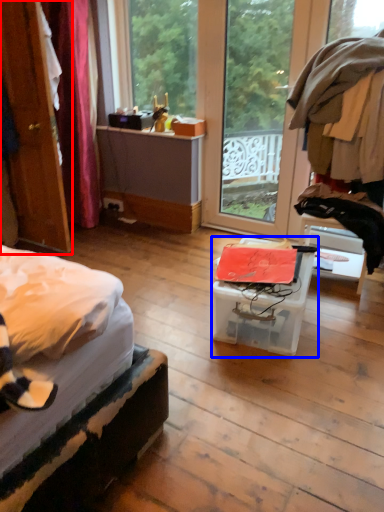
Question: Which object is closer to the camera taking this photo, door (highlighted by a red box) or box (highlighted by a blue box)?

Choices:
 (A) door
 (B) box

Answer: (B)